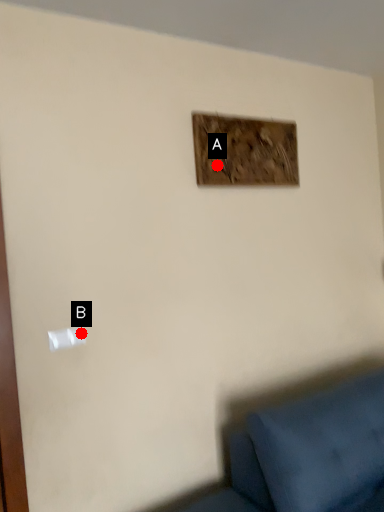
Question: Two points are circled on the image, labeled by A and B beside each circle. Among these points, which one is farthest from the camera?

Choices:
 (A) A is further
 (B) B is further

Answer: (A)